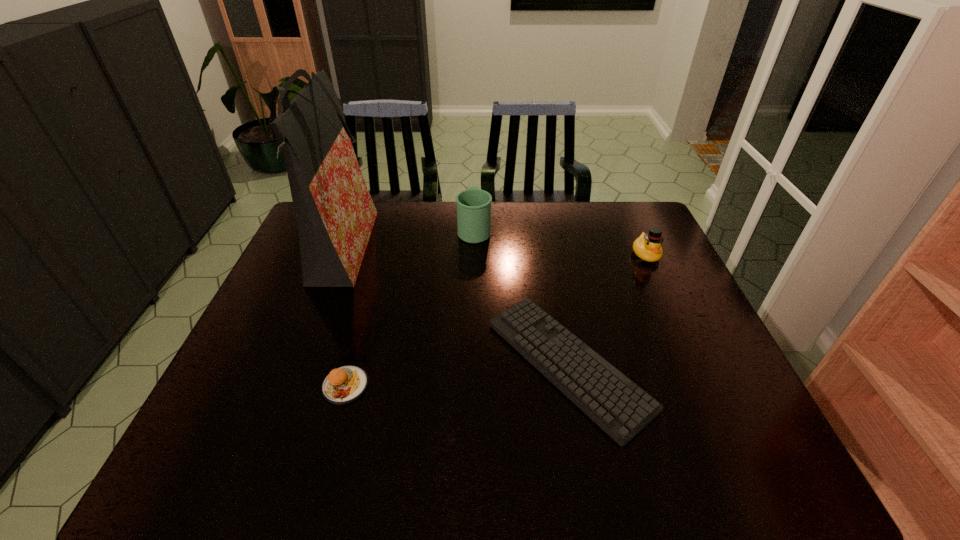
In order to click on shopping bag that is positioned at the far edge in this screenshot , I will do `click(335, 214)`.

I want to click on mug that is at the far edge, so click(473, 205).

The image size is (960, 540). I want to click on object that is at the near edge, so click(x=621, y=408).

At what (x,y) coordinates should I click in order to perform the action: click on object situated at the left edge. Please return your answer as a coordinate pair (x, y). Looking at the image, I should click on (335, 214).

Find the location of a particular element. object that is positioned at the right edge is located at coordinates (647, 247).

You are a GUI agent. You are given a task and a screenshot of the screen. Output one action in this format:
    pyautogui.click(x=<x>, y=<y>)
    Task: Click on the object that is at the far left corner
    This screenshot has height=540, width=960.
    Given the screenshot: What is the action you would take?
    pyautogui.click(x=335, y=214)

Locate an element on the screen. vacant space at the far edge is located at coordinates (566, 206).

The height and width of the screenshot is (540, 960). What are the coordinates of `free spot at the near edge of the desktop` in the screenshot? It's located at [289, 484].

In the image, there is a desktop. Identify the location of vacant space at the left edge. The image size is (960, 540). (294, 256).

Find the location of a particular element. The image size is (960, 540). blank space at the right edge is located at coordinates (664, 258).